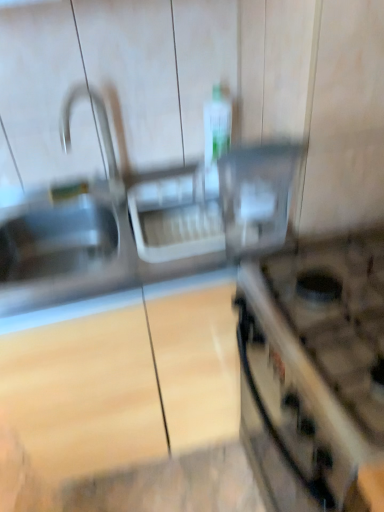
Question: In terms of width, does translucent plastic bottle at center look wider or thinner when compared to satin nickel faucet at upper left?

Choices:
 (A) wide
 (B) thin

Answer: (B)

Question: Is point (205, 138) positioned closer to the camera than point (99, 125)?

Choices:
 (A) farther
 (B) closer

Answer: (A)

Question: Which object is positioned farthest from the translucent plastic bottle at center?

Choices:
 (A) metallic silver gas stove at right
 (B) clear plastic container at center
 (C) satin nickel faucet at upper left

Answer: (A)

Question: Which object is the farthest from the metallic silver gas stove at right?

Choices:
 (A) translucent plastic bottle at center
 (B) clear plastic container at center
 (C) satin nickel faucet at upper left

Answer: (C)